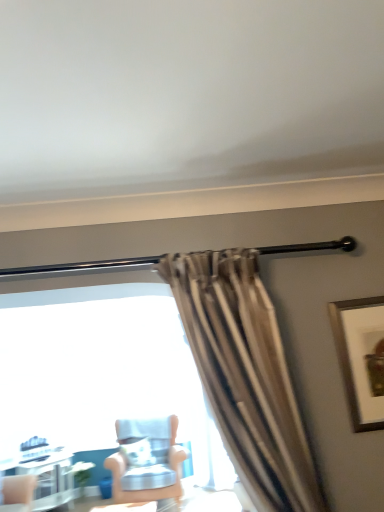
Question: Considering the positions of white glossy table at lower left and light blue fabric chair at center in the image, is white glossy table at lower left taller or shorter than light blue fabric chair at center?

Choices:
 (A) tall
 (B) short

Answer: (B)

Question: In terms of size, does white glossy table at lower left appear bigger or smaller than light blue fabric chair at center?

Choices:
 (A) big
 (B) small

Answer: (B)

Question: Based on their relative distances, which object is farther from the wooden framed artwork at upper right?

Choices:
 (A) white glossy table at lower left
 (B) light blue fabric chair at center

Answer: (A)

Question: Based on their relative distances, which object is nearer to the light blue fabric chair at center?

Choices:
 (A) white glossy table at lower left
 (B) wooden framed artwork at upper right

Answer: (A)